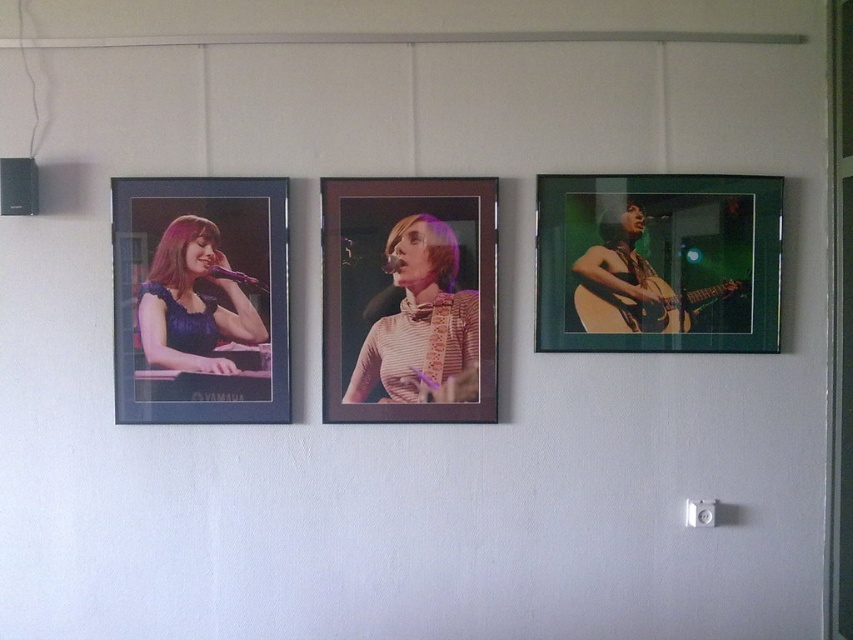
You are standing in front of the three framed photographs on the white wall. You notice two specific points marked on the wall at coordinates point (590, 317) and point (241, 314). Which of these points is closer to your eyes?

Point (590, 317) is further to the camera than point (241, 314), so the point closer to your eyes would be point (241, 314).

You are an interior designer planning to add a new painting to the wall where the green matte picture frame at right and the acoustic wood guitar at right are displayed. The new painting is 1.2 meters wide. Can you place it between these two items without overlapping them?

The green matte picture frame at right is positioned over the acoustic wood guitar at right, meaning they are already overlapping. Therefore, there is no space between them to place the new painting without overlapping further.

You are an interior designer planning to hang a new painting between the matte black frame at left and the matte purple dress at left. The painting is 1.5 inches wide. Will there be enough space between them to fit the new painting?

The space between the matte black frame at left and the matte purple dress at left is 1.39 inches, which is less than the painting width of 1.5 inches. Therefore, the painting will not fit between them.